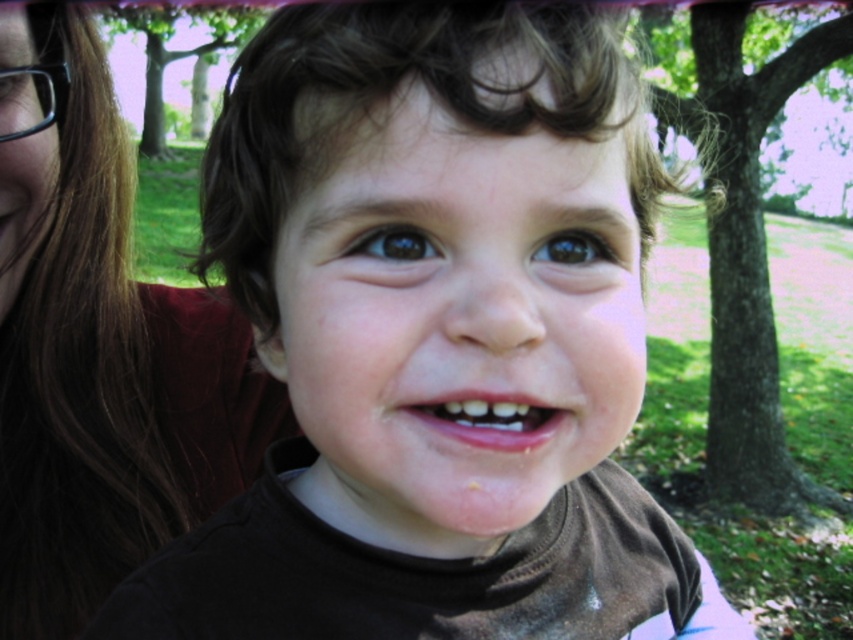
The child is wearing black matte glasses at upper left and has a brown matte eye at center. Which object is taller?

The black matte glasses at upper left is taller than the brown matte eye at center.

Consider the image. Based on the scene description, which object is positioned higher in the image, the brown hair at upper left or the brown matte eye at center?

The brown hair at upper left is much taller than the brown matte eye at center.

You are a photographer trying to capture a closeup of the child in the image. The point at coordinates point (103, 371) marks the location of the brown hair at upper left. Where should you focus your camera to ensure the brown hair at upper left is in sharp focus?

The point at coordinates point (103, 371) indicates the brown hair at upper left, so you should focus your camera on that exact point to ensure the brown hair at upper left is in sharp focus.